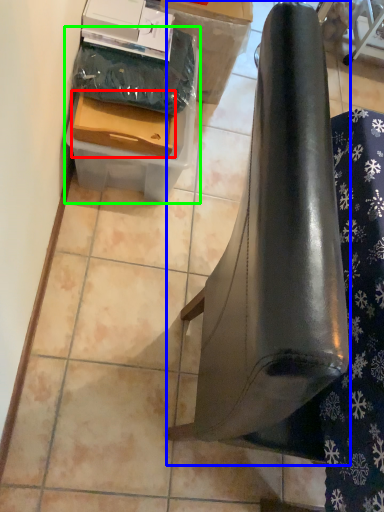
Question: Based on their relative distances, which object is nearer to drawer (highlighted by a red box)? Choose from furniture (highlighted by a blue box) and cardboard box (highlighted by a green box).

Choices:
 (A) furniture
 (B) cardboard box

Answer: (B)